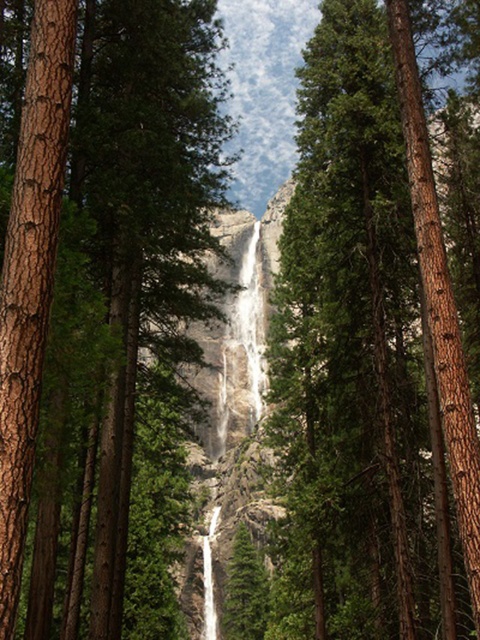
Which is above, brown rough bark tree at center or green rough bark tree at center?

Positioned higher is brown rough bark tree at center.

Describe the element at coordinates (103, 278) in the screenshot. I see `brown rough bark tree at center` at that location.

Find the location of `brown rough bark tree at center`. brown rough bark tree at center is located at coordinates (103, 278).